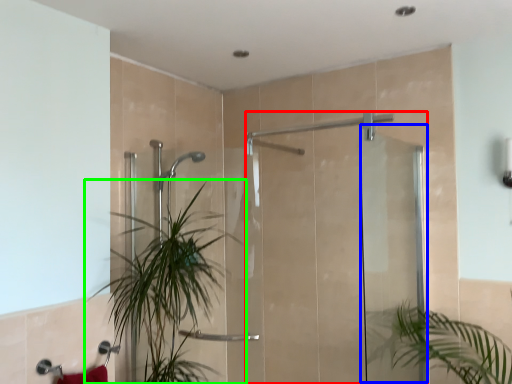
Question: Based on their relative distances, which object is farther from screen door (highlighted by a red box)? Choose from screen door (highlighted by a blue box) and houseplant (highlighted by a green box).

Choices:
 (A) screen door
 (B) houseplant

Answer: (B)